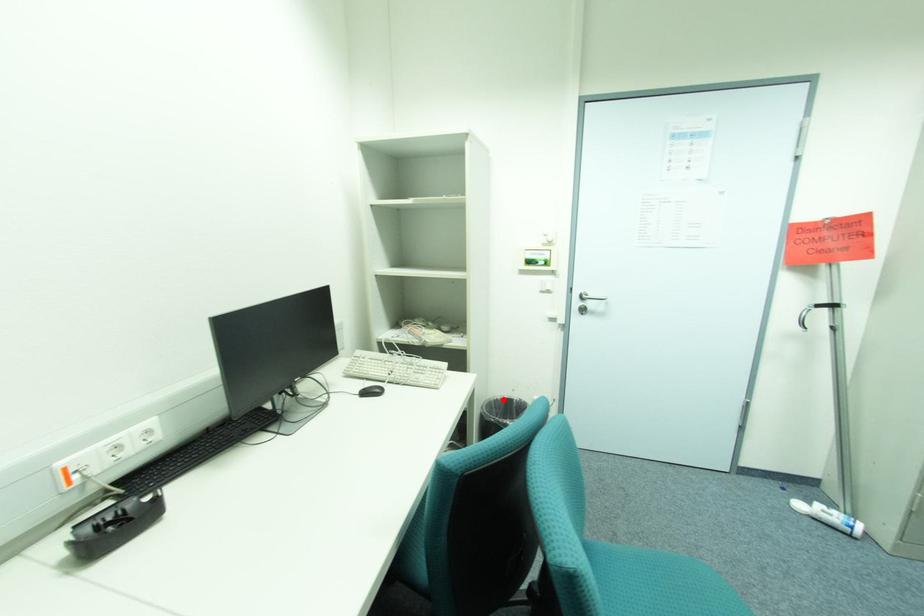
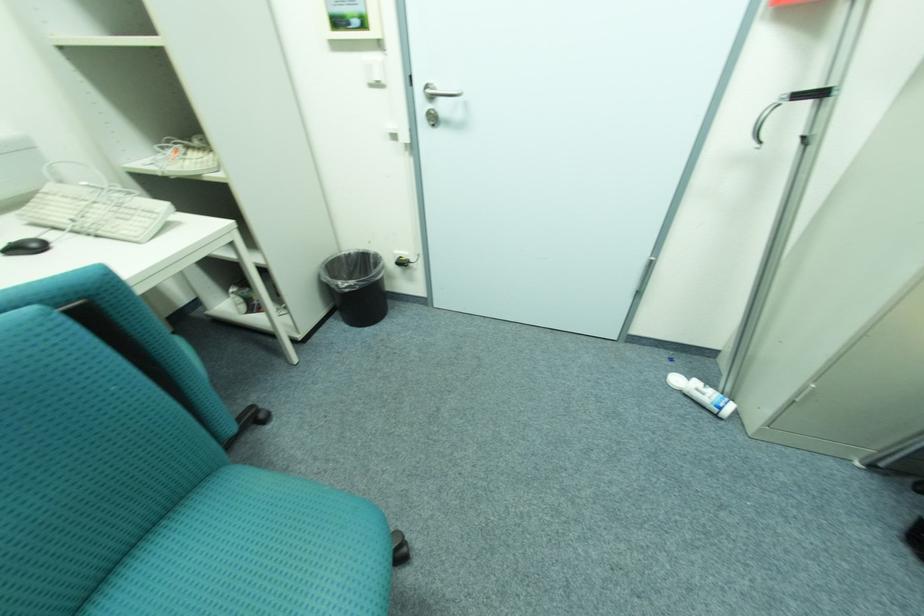
The point at the highlighted location is marked in the first image. Where is the corresponding point in the second image?

(358, 254)